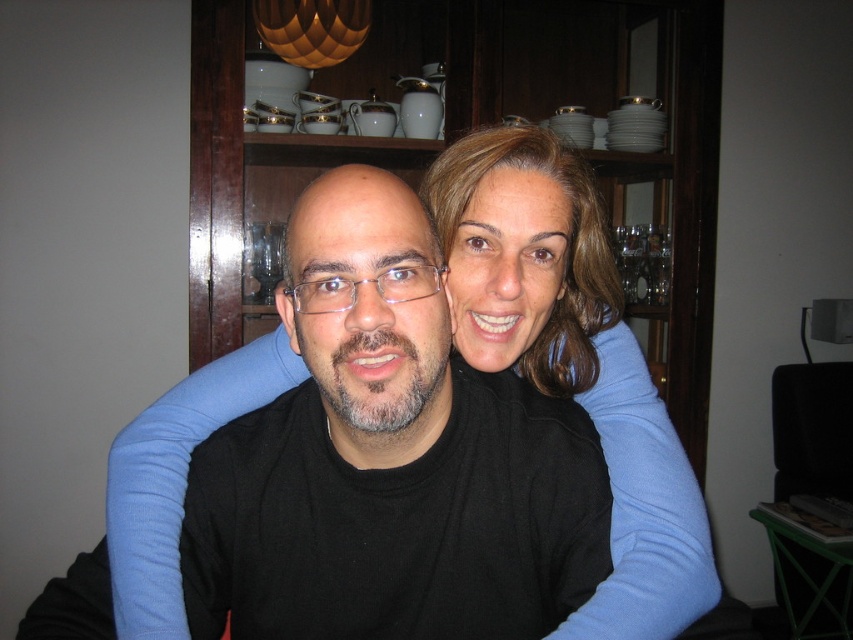
Question: Can you confirm if black matte shirt at center is positioned to the right of smooth brown hair at center?

Choices:
 (A) no
 (B) yes

Answer: (A)

Question: Which point appears farthest from the camera in this image?

Choices:
 (A) (566, 346)
 (B) (608, 364)

Answer: (A)

Question: Which point is closer to the camera?

Choices:
 (A) (663, 545)
 (B) (111, 467)

Answer: (A)

Question: Does black matte shirt at center appear over smooth brown hair at center?

Choices:
 (A) no
 (B) yes

Answer: (A)

Question: Which object is closer to the camera taking this photo?

Choices:
 (A) smooth brown hair at center
 (B) black matte shirt at center

Answer: (A)

Question: Can you confirm if black matte shirt at center is smaller than smooth brown hair at center?

Choices:
 (A) yes
 (B) no

Answer: (B)